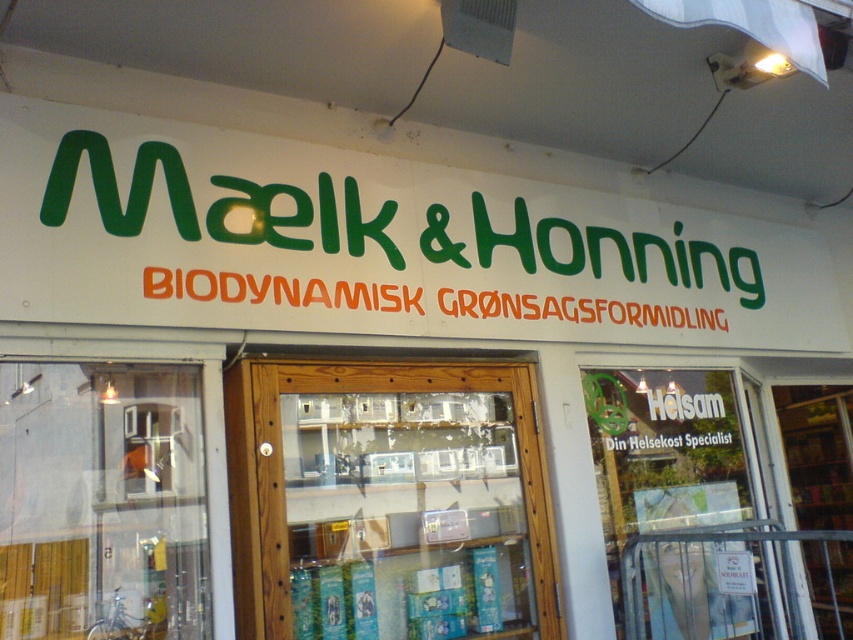
Is wooden door at center closer to the viewer compared to transparent glass door at center?

Yes, it is in front of transparent glass door at center.

This screenshot has width=853, height=640. In order to click on wooden door at center in this screenshot , I will do `click(389, 502)`.

Find the location of a particular element. The height and width of the screenshot is (640, 853). wooden door at center is located at coordinates (389, 502).

Does transparent glass door at lower left appear on the left side of transparent glass door at center?

Correct, you'll find transparent glass door at lower left to the left of transparent glass door at center.

Does transparent glass door at lower left have a larger size compared to transparent glass door at center?

Incorrect, transparent glass door at lower left is not larger than transparent glass door at center.

Does point (125, 408) come in front of point (595, 412)?

Yes, it is in front of point (595, 412).

Image resolution: width=853 pixels, height=640 pixels. Identify the location of transparent glass door at lower left. (102, 502).

Can you confirm if wooden door at center is smaller than transparent glass door at lower left?

No.

Does wooden door at center have a greater height compared to transparent glass door at lower left?

Correct, wooden door at center is much taller as transparent glass door at lower left.

Is point (466, 464) closer to camera compared to point (10, 627)?

No, (466, 464) is behind (10, 627).

Find the location of `wooden door at center`. wooden door at center is located at coordinates (389, 502).